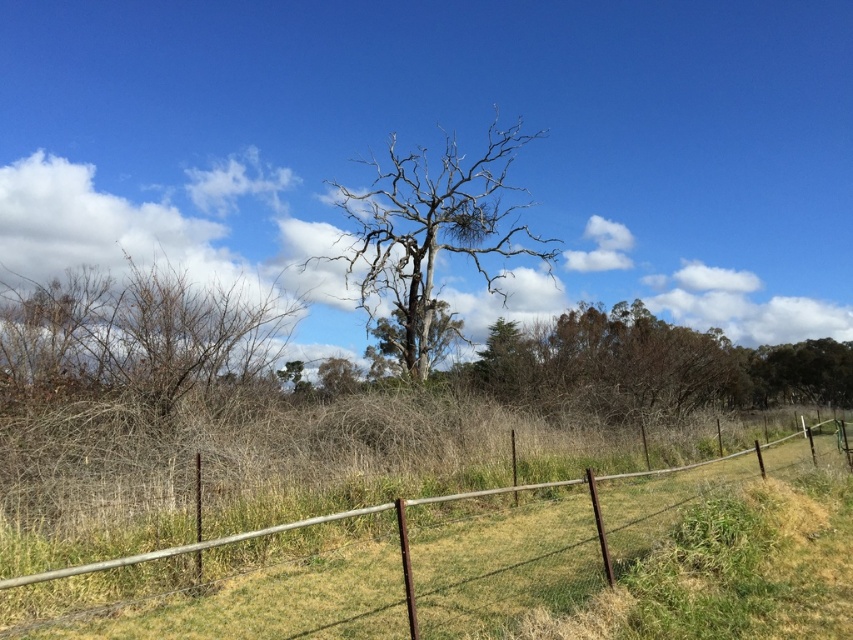
Question: Can you confirm if brown dry bush at left is positioned below bare wood tree at center?

Choices:
 (A) yes
 (B) no

Answer: (A)

Question: Which of the following is the closest to the observer?

Choices:
 (A) bare wood tree at center
 (B) gray bark tree at center
 (C) brown dry bush at left

Answer: (C)

Question: From the image, what is the correct spatial relationship of brown dry bush at left in relation to gray bark tree at center?

Choices:
 (A) right
 (B) left

Answer: (B)

Question: Which object appears farthest from the camera in this image?

Choices:
 (A) green leafy tree at right
 (B) gray bark tree at center

Answer: (A)

Question: Which of these objects is positioned farthest from the gray bark tree at center?

Choices:
 (A) brown dry bush at left
 (B) bare wood tree at center
 (C) green leafy tree at right

Answer: (C)

Question: Does brown dry bush at left appear on the right side of green leafy tree at right?

Choices:
 (A) no
 (B) yes

Answer: (A)